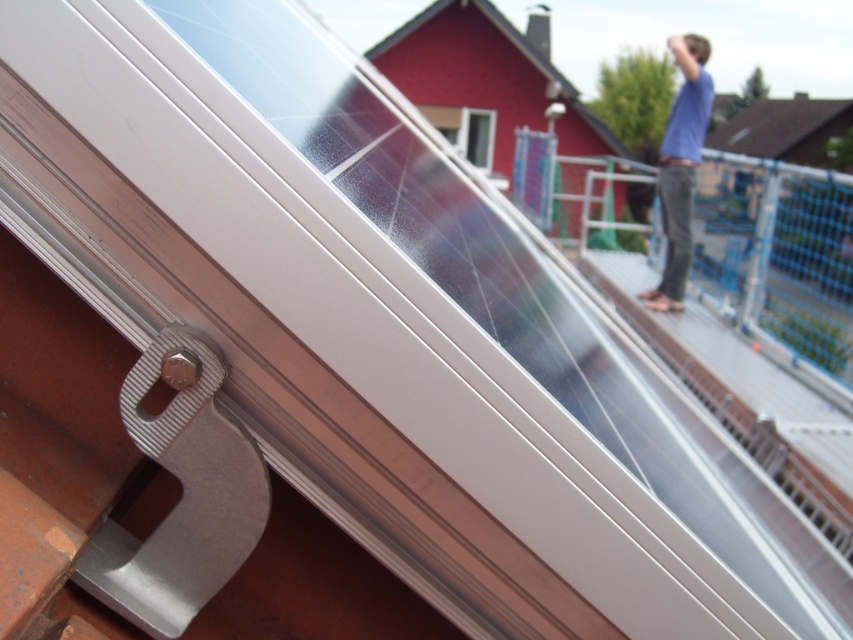
Question: Considering the relative positions of blue cotton shirt at upper right and transparent glass window at upper center in the image provided, where is blue cotton shirt at upper right located with respect to transparent glass window at upper center?

Choices:
 (A) above
 (B) below

Answer: (B)

Question: Among these points, which one is nearest to the camera?

Choices:
 (A) (491, 148)
 (B) (701, 64)

Answer: (B)

Question: Is blue cotton shirt at upper right further to camera compared to transparent glass window at upper center?

Choices:
 (A) no
 (B) yes

Answer: (A)

Question: Is blue cotton shirt at upper right below transparent glass window at upper center?

Choices:
 (A) no
 (B) yes

Answer: (B)

Question: Which of the following is the farthest from the observer?

Choices:
 (A) (492, 113)
 (B) (676, 182)

Answer: (A)